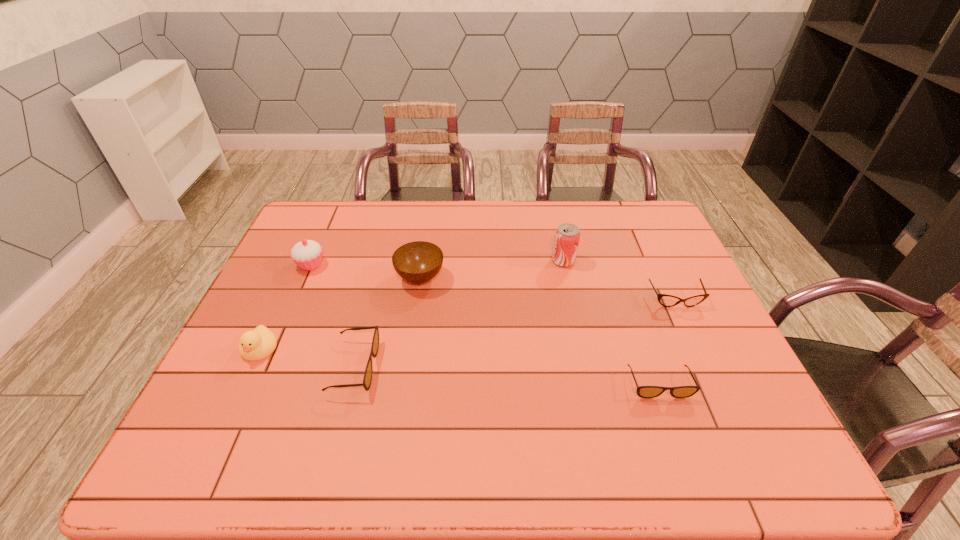
What are the coordinates of `the left sunglasses` in the screenshot? It's located at (367, 379).

Where is `the taller sunglasses`? The height and width of the screenshot is (540, 960). the taller sunglasses is located at coordinates (367, 379).

The image size is (960, 540). I want to click on the shorter sunglasses, so click(x=642, y=391).

The image size is (960, 540). In order to click on spectacles in this screenshot , I will do `click(665, 300)`.

The image size is (960, 540). Identify the location of the fifth object from left to right. (566, 240).

Find the location of `the tallest object`. the tallest object is located at coordinates (566, 240).

Where is `bowl`? Image resolution: width=960 pixels, height=540 pixels. bowl is located at coordinates (418, 262).

Where is `duckling`? This screenshot has height=540, width=960. duckling is located at coordinates [x=254, y=345].

Locate an element on the screen. cupcake is located at coordinates (307, 254).

Where is `free point located on the front-facing side of the fifth object from right to left`? This screenshot has height=540, width=960. free point located on the front-facing side of the fifth object from right to left is located at coordinates (491, 367).